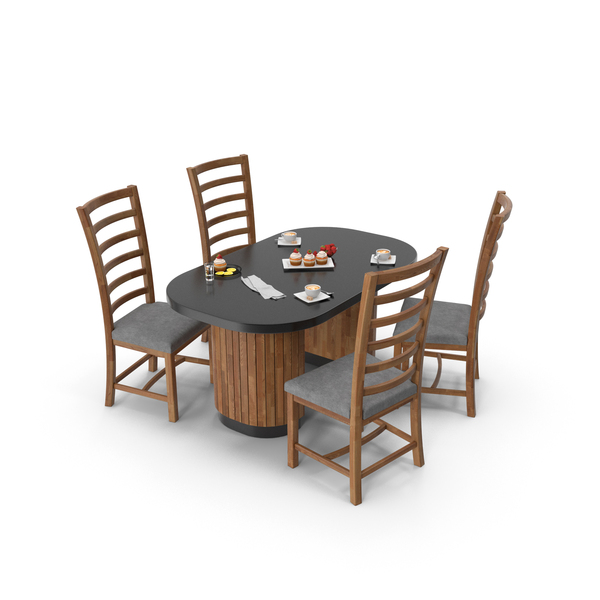
Identify the location of white plate. (288, 264).